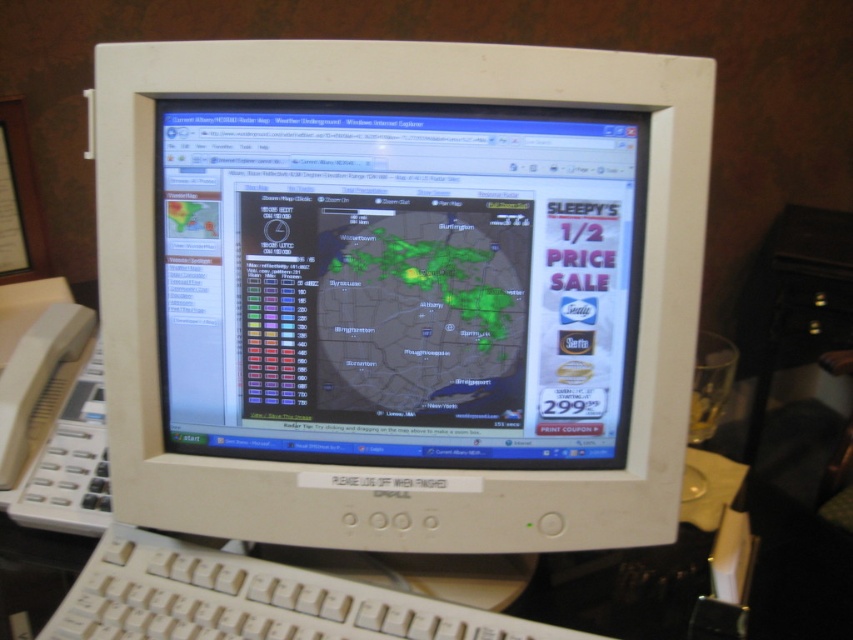
Which is more to the right, white plastic monitor at center or white plastic keyboard at lower center?

Positioned to the right is white plastic monitor at center.

Does white plastic monitor at center appear on the left side of white plastic keyboard at lower center?

No, white plastic monitor at center is not to the left of white plastic keyboard at lower center.

Between point (361, 420) and point (84, 608), which one is positioned behind?

The point (361, 420) is behind.

Find the location of a particular element. This screenshot has width=853, height=640. white plastic monitor at center is located at coordinates (399, 291).